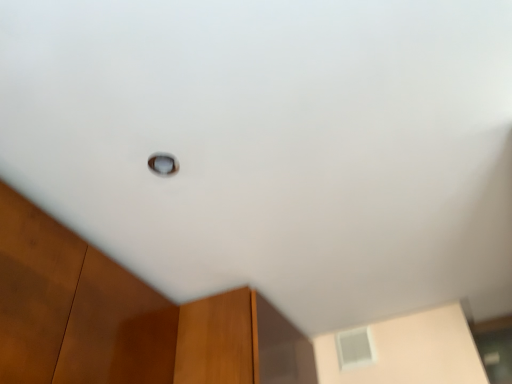
Question: Can you confirm if transparent glass window at center, which ranks as the second window in right-to-left order, is shorter than white frosted glass window at upper center, placed as the first window when sorted from bottom to top?

Choices:
 (A) yes
 (B) no

Answer: (A)

Question: Can you confirm if transparent glass window at center, which ranks as the second window in back-to-front order, is bigger than white frosted glass window at upper center, the second window when ordered from front to back?

Choices:
 (A) yes
 (B) no

Answer: (B)

Question: Considering the relative sizes of transparent glass window at center, arranged as the 1th window when viewed from the left, and white frosted glass window at upper center, the second window when ordered from front to back, in the image provided, is transparent glass window at center, arranged as the 1th window when viewed from the left, thinner than white frosted glass window at upper center, the second window when ordered from front to back,?

Choices:
 (A) no
 (B) yes

Answer: (B)

Question: Is transparent glass window at center, acting as the 1th window starting from the front, to the left of white frosted glass window at upper center, the second window in the left-to-right sequence, from the viewer's perspective?

Choices:
 (A) no
 (B) yes

Answer: (B)

Question: Is transparent glass window at center, placed as the first window when sorted from top to bottom, smaller than white frosted glass window at upper center, the second window when ordered from front to back?

Choices:
 (A) no
 (B) yes

Answer: (B)

Question: From a real-world perspective, is transparent glass window at center, arranged as the 1th window when viewed from the left, on top of white frosted glass window at upper center, the first window in the back-to-front sequence?

Choices:
 (A) yes
 (B) no

Answer: (A)

Question: Does white frosted glass window at upper center, placed as the second window when sorted from top to bottom, have a greater height compared to transparent glass window at center, which ranks as the second window in back-to-front order?

Choices:
 (A) yes
 (B) no

Answer: (A)

Question: From the image's perspective, is white frosted glass window at upper center, the first window in the back-to-front sequence, located above transparent glass window at center, arranged as the 1th window when viewed from the left?

Choices:
 (A) yes
 (B) no

Answer: (B)

Question: Does white frosted glass window at upper center, the first window in the back-to-front sequence, have a smaller size compared to transparent glass window at center, the second window when ordered from bottom to top?

Choices:
 (A) no
 (B) yes

Answer: (A)

Question: Is white frosted glass window at upper center, placed as the second window when sorted from top to bottom, thinner than transparent glass window at center, which ranks as the second window in right-to-left order?

Choices:
 (A) no
 (B) yes

Answer: (A)

Question: Can you confirm if white frosted glass window at upper center, the second window in the left-to-right sequence, is positioned to the left of transparent glass window at center, the second window when ordered from bottom to top?

Choices:
 (A) yes
 (B) no

Answer: (B)

Question: Is white frosted glass window at upper center, placed as the second window when sorted from top to bottom, behind transparent glass window at center, which ranks as the second window in right-to-left order?

Choices:
 (A) no
 (B) yes

Answer: (B)

Question: From a real-world perspective, is white frosted glass window at upper center, the second window in the left-to-right sequence, physically located above or below transparent glass window at center, arranged as the 1th window when viewed from the left?

Choices:
 (A) below
 (B) above

Answer: (A)